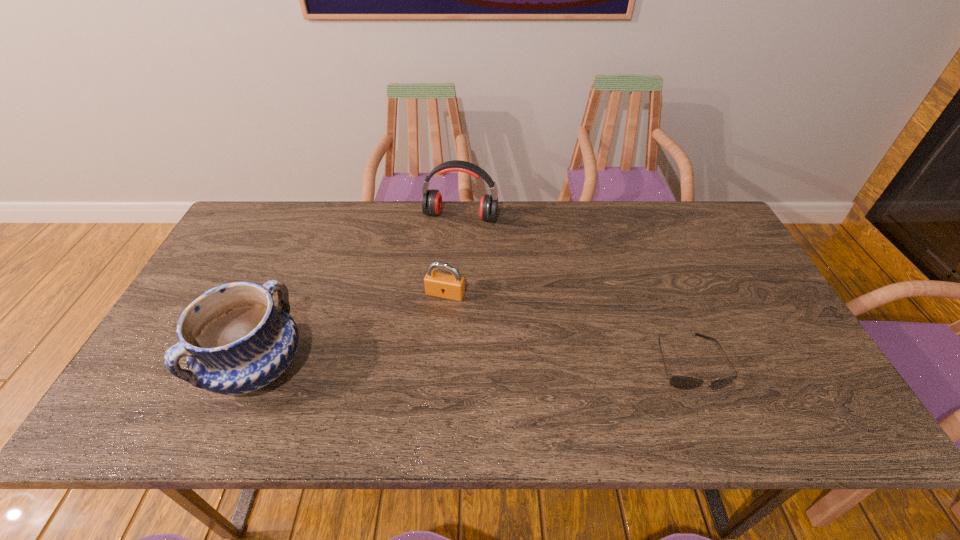
Where is `unoccupied position between the second shortest object and the rightmost object`? unoccupied position between the second shortest object and the rightmost object is located at coordinates (566, 328).

Identify the location of vacant space in between the rightmost object and the third nearest object. This screenshot has width=960, height=540. (566, 328).

The image size is (960, 540). In order to click on vacant point located between the leftmost object and the farthest object in this screenshot , I will do `click(359, 291)`.

Find the location of `object that stands as the closest to the third tallest object`. object that stands as the closest to the third tallest object is located at coordinates (432, 199).

In order to click on the third closest object to the earphone in this screenshot , I will do `click(681, 382)`.

You are a GUI agent. You are given a task and a screenshot of the screen. Output one action in this format:
    pyautogui.click(x=<x>, y=<y>)
    Task: Click on the free location that satisfies the following two spatial constraints: 1. on the back side of the third tallest object; 2. on the left side of the leftmost object
    The image size is (960, 540).
    Given the screenshot: What is the action you would take?
    pyautogui.click(x=288, y=294)

You are a GUI agent. You are given a task and a screenshot of the screen. Output one action in this format:
    pyautogui.click(x=<x>, y=<y>)
    Task: Click on the free space that satisfies the following two spatial constraints: 1. on the back side of the earphone; 2. on the right side of the leftmost object
    
    Given the screenshot: What is the action you would take?
    pyautogui.click(x=321, y=216)